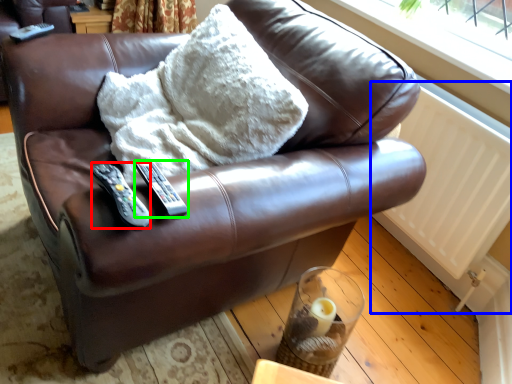
Question: Which object is positioned farthest from remote (highlighted by a red box)? Select from radiator (highlighted by a blue box) and remote (highlighted by a green box).

Choices:
 (A) radiator
 (B) remote

Answer: (A)